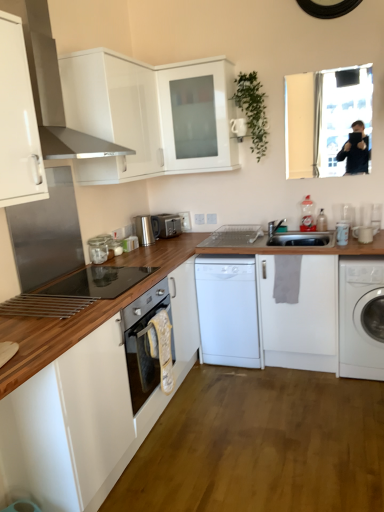
Question: Is metallic stainless steel range hood at upper left located within white glossy mug at right, the 4th appliance when ordered from left to right?

Choices:
 (A) yes
 (B) no

Answer: (B)

Question: From a real-world perspective, is white glossy mug at right, the 4th appliance positioned from the back, on metallic stainless steel range hood at upper left?

Choices:
 (A) no
 (B) yes

Answer: (A)

Question: Considering the relative sizes of white glossy mug at right, the 4th appliance when ordered from left to right, and metallic stainless steel range hood at upper left in the image provided, is white glossy mug at right, the 4th appliance when ordered from left to right, wider than metallic stainless steel range hood at upper left?

Choices:
 (A) no
 (B) yes

Answer: (A)

Question: Is white glossy mug at right, which is the first appliance from right to left, to the left of metallic stainless steel range hood at upper left from the viewer's perspective?

Choices:
 (A) no
 (B) yes

Answer: (A)

Question: From the image's perspective, is white glossy mug at right, the 4th appliance when ordered from left to right, located beneath metallic stainless steel range hood at upper left?

Choices:
 (A) yes
 (B) no

Answer: (A)

Question: From a real-world perspective, relative to white matte dishwasher at center, acting as the 1th washing machine starting from the left, is white matte cabinet at upper center, the first cabinetry from the top, vertically above or below?

Choices:
 (A) above
 (B) below

Answer: (A)

Question: In terms of height, does white matte cabinet at upper center, which appears as the fifth cabinetry when ordered from the bottom, look taller or shorter compared to white matte dishwasher at center, acting as the 1th washing machine starting from the left?

Choices:
 (A) tall
 (B) short

Answer: (B)

Question: Based on their positions, is white matte cabinet at upper center, the first cabinetry from the top, located to the left or right of white matte dishwasher at center, marked as the 2th washing machine in a right-to-left arrangement?

Choices:
 (A) left
 (B) right

Answer: (A)

Question: Is white matte cabinet at upper center, which appears as the fifth cabinetry when ordered from the bottom, bigger or smaller than white matte dishwasher at center, marked as the 2th washing machine in a right-to-left arrangement?

Choices:
 (A) big
 (B) small

Answer: (B)

Question: From the image's perspective, is white matte washing machine at right, marked as the 1th washing machine in a right-to-left arrangement, above or below white glossy cabinet at upper center, acting as the fourth cabinetry starting from the bottom?

Choices:
 (A) below
 (B) above

Answer: (A)

Question: Is white matte washing machine at right, the second washing machine viewed from the left, bigger or smaller than white glossy cabinet at upper center, acting as the fourth cabinetry starting from the bottom?

Choices:
 (A) big
 (B) small

Answer: (B)

Question: Is point (369, 372) positioned closer to the camera than point (210, 93)?

Choices:
 (A) closer
 (B) farther

Answer: (A)

Question: From a real-world perspective, is white matte washing machine at right, the second washing machine viewed from the left, above or below white glossy cabinet at upper center, which appears as the second cabinetry when viewed from the top?

Choices:
 (A) above
 (B) below

Answer: (B)

Question: From the image's perspective, is white matte dishwasher at center, marked as the 2th washing machine in a right-to-left arrangement, located above or below white glossy mug at right, which is counted as the 2th appliance, starting from the right?

Choices:
 (A) below
 (B) above

Answer: (A)

Question: Based on their sizes in the image, would you say white matte dishwasher at center, acting as the 1th washing machine starting from the left, is bigger or smaller than white glossy mug at right, which is the third appliance from back to front?

Choices:
 (A) big
 (B) small

Answer: (A)